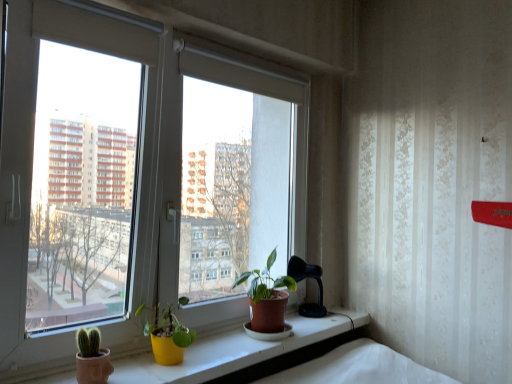
The image size is (512, 384). Find the location of `vacant space in between yellow matte pot at lower center, the first houseplant in the front-to-back sequence, and matte brown pot at center, the second houseplant positioned from the front`. vacant space in between yellow matte pot at lower center, the first houseplant in the front-to-back sequence, and matte brown pot at center, the second houseplant positioned from the front is located at coordinates (219, 351).